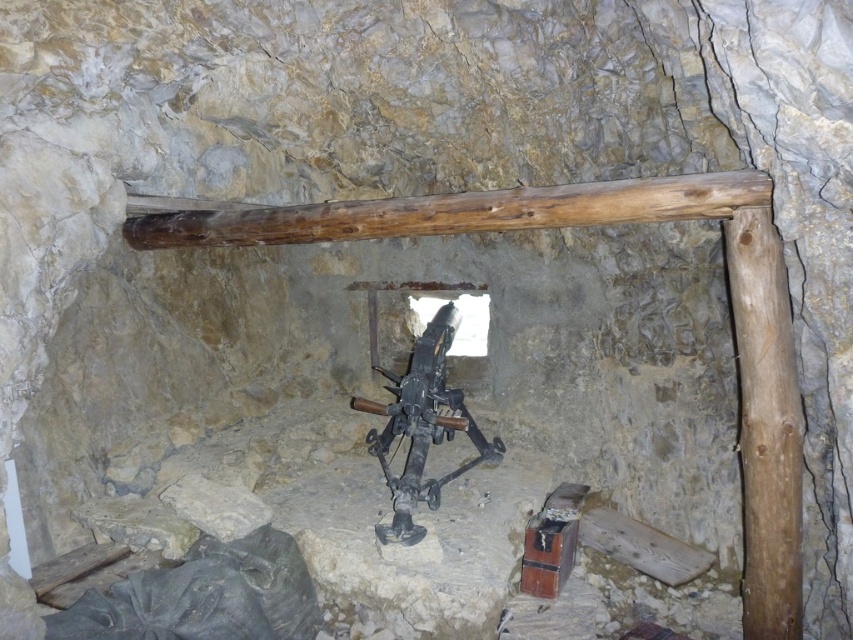
Question: Which of the following is the closest to the observer?

Choices:
 (A) (439, 332)
 (B) (640, 196)

Answer: (B)

Question: Which point is farther to the camera?

Choices:
 (A) brown wooden beam at upper center
 (B) rusty metal crossbow at center

Answer: (B)

Question: Is brown wooden beam at upper center wider than rusty metal crossbow at center?

Choices:
 (A) no
 (B) yes

Answer: (B)

Question: Is brown wooden beam at upper center below rusty metal crossbow at center?

Choices:
 (A) yes
 (B) no

Answer: (B)

Question: Observing the image, what is the correct spatial positioning of brown wooden beam at upper center in reference to rusty metal crossbow at center?

Choices:
 (A) below
 (B) above

Answer: (B)